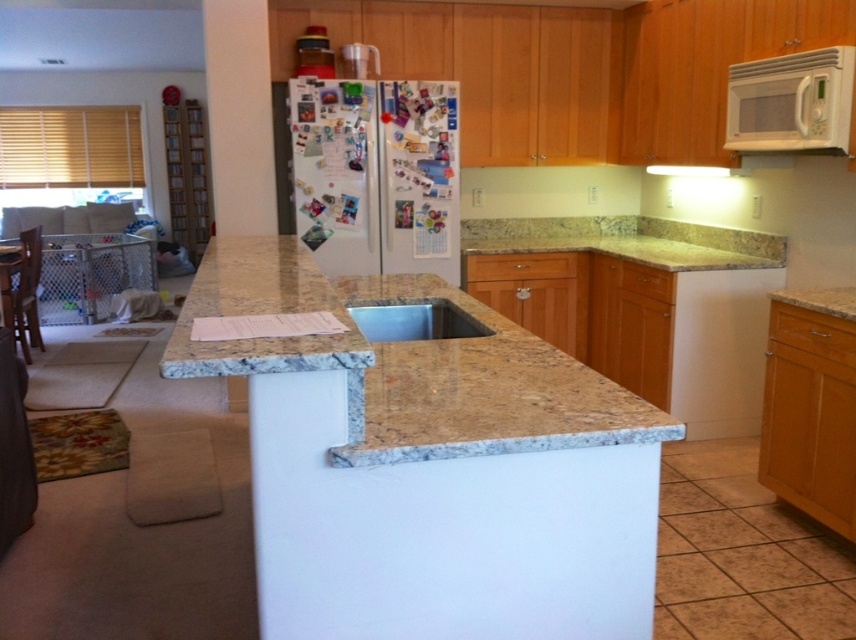
Question: Among these points, which one is nearest to the camera?

Choices:
 (A) (583, 433)
 (B) (444, 314)
 (C) (473, 220)
 (D) (798, 90)

Answer: (A)

Question: Does white matte refrigerator at upper center appear on the left side of metallic stainless steel sink at center?

Choices:
 (A) yes
 (B) no

Answer: (A)

Question: Observing the image, what is the correct spatial positioning of yellow granite countertop at upper right in reference to metallic stainless steel sink at center?

Choices:
 (A) right
 (B) left

Answer: (A)

Question: Does white matte microwave at upper right have a lesser width compared to yellow granite countertop at upper right?

Choices:
 (A) yes
 (B) no

Answer: (A)

Question: Which of these objects is positioned farthest from the metallic stainless steel sink at center?

Choices:
 (A) white matte refrigerator at upper center
 (B) yellow granite countertop at upper right
 (C) beige granite countertop at center
 (D) white matte microwave at upper right

Answer: (B)

Question: Estimate the real-world distances between objects in this image. Which object is closer to the beige granite countertop at center?

Choices:
 (A) white matte refrigerator at upper center
 (B) metallic stainless steel sink at center

Answer: (B)